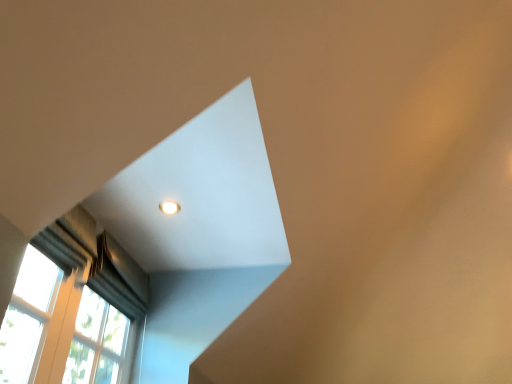
Where is `dark gray textured curtain at left`? This screenshot has width=512, height=384. dark gray textured curtain at left is located at coordinates (118, 273).

Describe the element at coordinates (118, 273) in the screenshot. I see `dark gray textured curtain at left` at that location.

Where is `white glossy light fixture at upper center`? This screenshot has width=512, height=384. white glossy light fixture at upper center is located at coordinates (169, 207).

This screenshot has width=512, height=384. Describe the element at coordinates (169, 207) in the screenshot. I see `white glossy light fixture at upper center` at that location.

Measure the distance between white glossy light fixture at upper center and camera.

The distance of white glossy light fixture at upper center from camera is 1.65 meters.

Image resolution: width=512 pixels, height=384 pixels. I want to click on dark gray textured curtain at left, so click(118, 273).

Between white glossy light fixture at upper center and dark gray textured curtain at left, which one appears on the left side from the viewer's perspective?

dark gray textured curtain at left is more to the left.

Which object is closer to the camera, white glossy light fixture at upper center or dark gray textured curtain at left?

dark gray textured curtain at left.

Does point (178, 208) lie in front of point (120, 254)?

Yes, it is.

In the scene shown: From the image's perspective, who appears lower, white glossy light fixture at upper center or dark gray textured curtain at left?

dark gray textured curtain at left.

From a real-world perspective, is white glossy light fixture at upper center physically below dark gray textured curtain at left?

Actually, white glossy light fixture at upper center is physically above dark gray textured curtain at left in the real world.

Looking at their sizes, would you say white glossy light fixture at upper center is wider or thinner than dark gray textured curtain at left?

white glossy light fixture at upper center is thinner than dark gray textured curtain at left.

Between white glossy light fixture at upper center and dark gray textured curtain at left, which one has less height?

With less height is white glossy light fixture at upper center.

Who is smaller, white glossy light fixture at upper center or dark gray textured curtain at left?

With smaller size is white glossy light fixture at upper center.

Is white glossy light fixture at upper center not inside dark gray textured curtain at left?

white glossy light fixture at upper center lies outside dark gray textured curtain at left's area.

Is white glossy light fixture at upper center placed right next to dark gray textured curtain at left?

There is a gap between white glossy light fixture at upper center and dark gray textured curtain at left.

Is white glossy light fixture at upper center positioned with its back to dark gray textured curtain at left?

No, white glossy light fixture at upper center's orientation is not away from dark gray textured curtain at left.

What's the angular difference between white glossy light fixture at upper center and dark gray textured curtain at left's facing directions?

The angle between the facing direction of white glossy light fixture at upper center and the facing direction of dark gray textured curtain at left is 1.64 degrees.

How far apart are white glossy light fixture at upper center and dark gray textured curtain at left?

white glossy light fixture at upper center and dark gray textured curtain at left are 39.66 centimeters apart from each other.

At what (x,y) coordinates should I click in order to perform the action: click on lighting located above the dark gray textured curtain at left (from a real-world perspective). Please return your answer as a coordinate pair (x, y). Looking at the image, I should click on (169, 207).

Can you confirm if dark gray textured curtain at left is positioned to the left of white glossy light fixture at upper center?

Indeed, dark gray textured curtain at left is positioned on the left side of white glossy light fixture at upper center.

Considering their positions, is dark gray textured curtain at left located in front of or behind white glossy light fixture at upper center?

dark gray textured curtain at left is in front of white glossy light fixture at upper center.

Which is farther from the camera, (141, 306) or (176, 205)?

Point (141, 306)

From the picture: From the image's perspective, is dark gray textured curtain at left under white glossy light fixture at upper center?

Yes, from the image's perspective, dark gray textured curtain at left is below white glossy light fixture at upper center.

From a real-world perspective, is dark gray textured curtain at left physically above white glossy light fixture at upper center?

No, from a real-world perspective, dark gray textured curtain at left is not above white glossy light fixture at upper center.

In terms of width, does dark gray textured curtain at left look wider or thinner when compared to white glossy light fixture at upper center?

In the image, dark gray textured curtain at left appears to be wider than white glossy light fixture at upper center.

Which of these two, dark gray textured curtain at left or white glossy light fixture at upper center, stands taller?

With more height is dark gray textured curtain at left.

Considering the relative sizes of dark gray textured curtain at left and white glossy light fixture at upper center in the image provided, is dark gray textured curtain at left smaller than white glossy light fixture at upper center?

Incorrect, dark gray textured curtain at left is not smaller in size than white glossy light fixture at upper center.

Can white glossy light fixture at upper center be found inside dark gray textured curtain at left?

Actually, white glossy light fixture at upper center is outside dark gray textured curtain at left.

Is dark gray textured curtain at left far from white glossy light fixture at upper center?

No, dark gray textured curtain at left is in close proximity to white glossy light fixture at upper center.

Is dark gray textured curtain at left aimed at white glossy light fixture at upper center?

Yes, dark gray textured curtain at left is oriented towards white glossy light fixture at upper center.

This screenshot has height=384, width=512. I want to click on curtain in front of the white glossy light fixture at upper center, so click(118, 273).

I want to click on lighting on the right of dark gray textured curtain at left, so click(x=169, y=207).

Identify the location of curtain below the white glossy light fixture at upper center (from a real-world perspective). The image size is (512, 384). (118, 273).